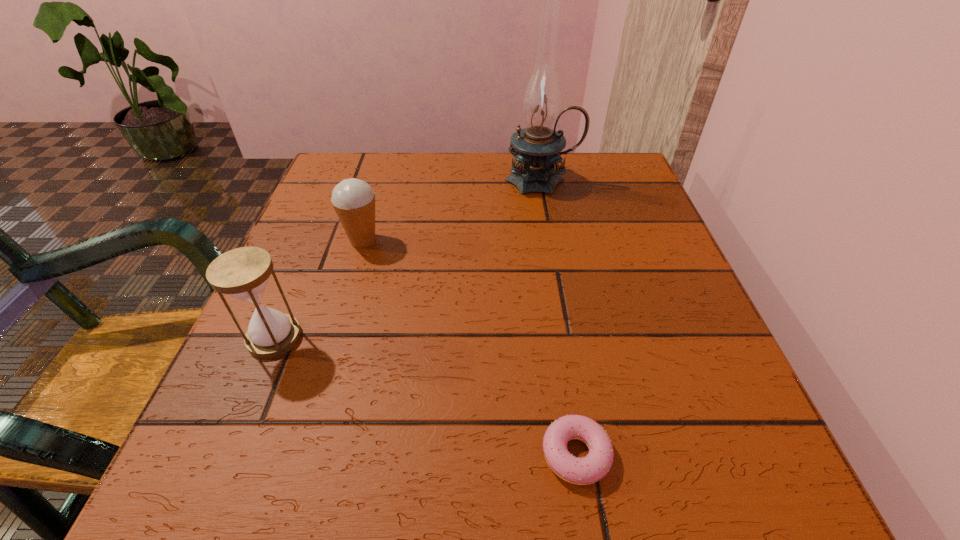
At what (x,y) coordinates should I click in order to perform the action: click on vacant region between the third object from right to left and the farthest object. Please return your answer as a coordinate pair (x, y). The width and height of the screenshot is (960, 540). Looking at the image, I should click on (453, 210).

Where is `vacant space that's between the oil lamp and the doughnut`? The width and height of the screenshot is (960, 540). vacant space that's between the oil lamp and the doughnut is located at coordinates (559, 317).

Identify the location of vacant space that's between the icecream and the second nearest object. (319, 289).

Identify the location of free space between the leftmost object and the shortest object. This screenshot has height=540, width=960. (425, 396).

This screenshot has width=960, height=540. What are the coordinates of `free spot between the oil lamp and the third farthest object` in the screenshot? It's located at (408, 259).

Point out which object is positioned as the second nearest to the nearest object. Please provide its 2D coordinates. Your answer should be formatted as a tuple, i.e. [(x, y)], where the tuple contains the x and y coordinates of a point satisfying the conditions above.

[(353, 200)]

Identify which object is the second nearest to the second object from left to right. Please provide its 2D coordinates. Your answer should be formatted as a tuple, i.e. [(x, y)], where the tuple contains the x and y coordinates of a point satisfying the conditions above.

[(537, 148)]

The width and height of the screenshot is (960, 540). I want to click on free space that satisfies the following two spatial constraints: 1. on the back side of the leftmost object; 2. on the left side of the third object from right to left, so click(316, 240).